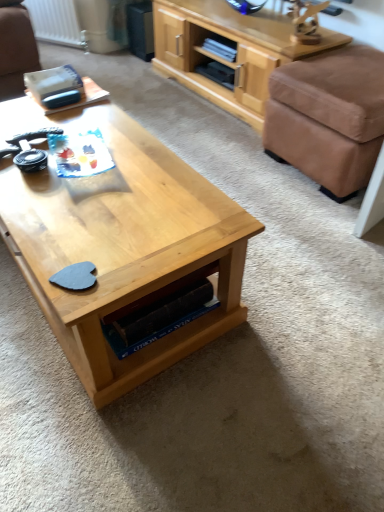
Image resolution: width=384 pixels, height=512 pixels. I want to click on blank space situated above brown fabric ottoman at right (from a real-world perspective), so click(x=350, y=68).